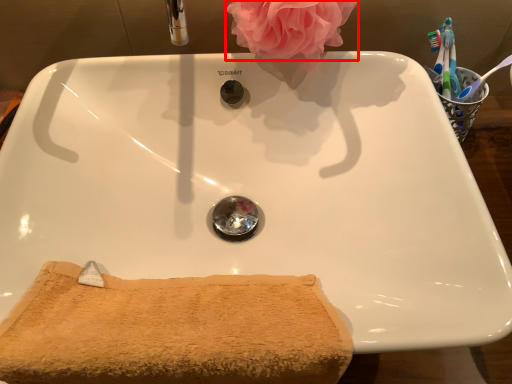
Question: From the image's perspective, where is rose (annotated by the red box) located in relation to bath towel in the image?

Choices:
 (A) above
 (B) below

Answer: (A)